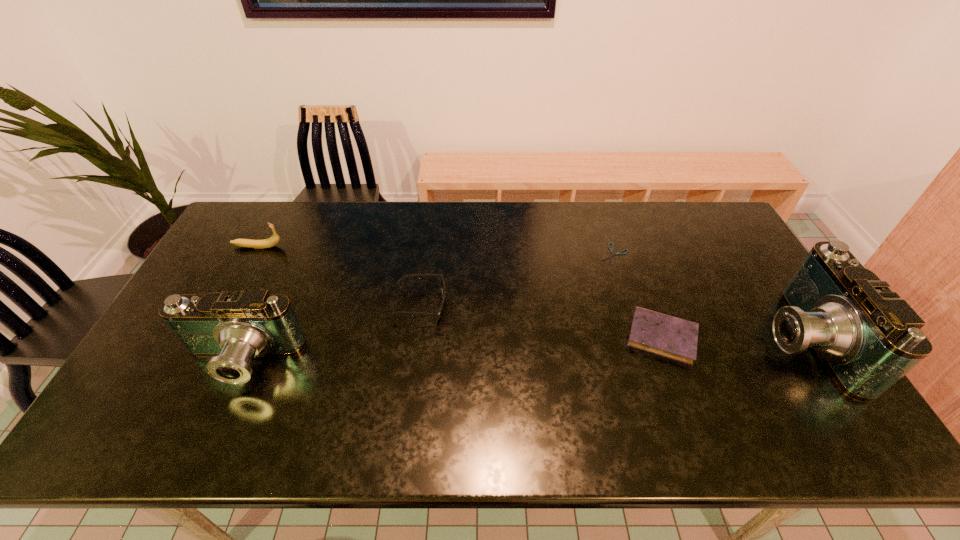
Where is `spot to insert another camcorder for uniform distribution`? The image size is (960, 540). spot to insert another camcorder for uniform distribution is located at coordinates pyautogui.click(x=527, y=351).